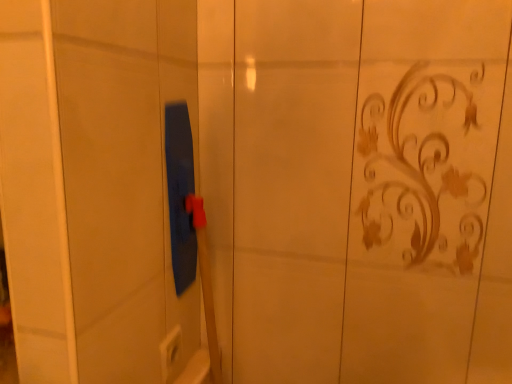
The width and height of the screenshot is (512, 384). Describe the element at coordinates (170, 353) in the screenshot. I see `white plastic electric outlet at lower center` at that location.

The image size is (512, 384). In order to click on white plastic electric outlet at lower center in this screenshot , I will do `click(170, 353)`.

The width and height of the screenshot is (512, 384). Find the location of `blue rubber squeegee at center`. blue rubber squeegee at center is located at coordinates (123, 178).

The image size is (512, 384). What do you see at coordinates (123, 178) in the screenshot? I see `blue rubber squeegee at center` at bounding box center [123, 178].

You are a GUI agent. You are given a task and a screenshot of the screen. Output one action in this format:
    pyautogui.click(x=<x>, y=<y>)
    Task: Click on the white plastic electric outlet at lower center
    
    Given the screenshot: What is the action you would take?
    pyautogui.click(x=170, y=353)

Is white plastic electric outlet at lower center to the left of blue rubber squeegee at center from the viewer's perspective?

No, white plastic electric outlet at lower center is not to the left of blue rubber squeegee at center.

Considering the relative positions of white plastic electric outlet at lower center and blue rubber squeegee at center in the image provided, is white plastic electric outlet at lower center in front of blue rubber squeegee at center?

No, it is behind blue rubber squeegee at center.

Which point is more forward, (174, 365) or (90, 187)?

The point (90, 187) is more forward.

From the image's perspective, would you say white plastic electric outlet at lower center is shown under blue rubber squeegee at center?

Yes.

From a real-world perspective, does white plastic electric outlet at lower center stand above blue rubber squeegee at center?

No, from a real-world perspective, white plastic electric outlet at lower center is not above blue rubber squeegee at center.

Does white plastic electric outlet at lower center have a lesser width compared to blue rubber squeegee at center?

Indeed, white plastic electric outlet at lower center has a lesser width compared to blue rubber squeegee at center.

Between white plastic electric outlet at lower center and blue rubber squeegee at center, which one has less height?

With less height is white plastic electric outlet at lower center.

Can you confirm if white plastic electric outlet at lower center is smaller than blue rubber squeegee at center?

Yes, white plastic electric outlet at lower center is smaller than blue rubber squeegee at center.

Is blue rubber squeegee at center inside white plastic electric outlet at lower center?

No, blue rubber squeegee at center is not surrounded by white plastic electric outlet at lower center.

Is white plastic electric outlet at lower center next to blue rubber squeegee at center and touching it?

They are not placed beside each other.

Is white plastic electric outlet at lower center aimed at blue rubber squeegee at center?

Yes, white plastic electric outlet at lower center is aimed at blue rubber squeegee at center.

How many degrees apart are the facing directions of white plastic electric outlet at lower center and blue rubber squeegee at center?

The angle between the facing direction of white plastic electric outlet at lower center and the facing direction of blue rubber squeegee at center is 90 degrees.

Locate an element on the screen. This screenshot has height=384, width=512. screen door above the white plastic electric outlet at lower center (from a real-world perspective) is located at coordinates (123, 178).

Considering the positions of objects blue rubber squeegee at center and white plastic electric outlet at lower center in the image provided, who is more to the left, blue rubber squeegee at center or white plastic electric outlet at lower center?

blue rubber squeegee at center is more to the left.

Does blue rubber squeegee at center come behind white plastic electric outlet at lower center?

No, the depth of blue rubber squeegee at center is less than that of white plastic electric outlet at lower center.

Does point (72, 294) come in front of point (165, 341)?

Yes, point (72, 294) is in front of point (165, 341).

From the image's perspective, does blue rubber squeegee at center appear lower than white plastic electric outlet at lower center?

Actually, blue rubber squeegee at center appears above white plastic electric outlet at lower center in the image.

From a real-world perspective, does blue rubber squeegee at center stand above white plastic electric outlet at lower center?

Yes.

Can you confirm if blue rubber squeegee at center is wider than white plastic electric outlet at lower center?

Yes, blue rubber squeegee at center is wider than white plastic electric outlet at lower center.

Which of these two, blue rubber squeegee at center or white plastic electric outlet at lower center, stands taller?

Standing taller between the two is blue rubber squeegee at center.

Based on the photo, in terms of size, does blue rubber squeegee at center appear bigger or smaller than white plastic electric outlet at lower center?

In the image, blue rubber squeegee at center appears to be larger than white plastic electric outlet at lower center.

Is white plastic electric outlet at lower center surrounded by blue rubber squeegee at center?

Yes, white plastic electric outlet at lower center can be found within blue rubber squeegee at center.

Would you consider blue rubber squeegee at center to be distant from white plastic electric outlet at lower center?

No, blue rubber squeegee at center is not far away from white plastic electric outlet at lower center.

Is blue rubber squeegee at center oriented away from white plastic electric outlet at lower center?

Absolutely, blue rubber squeegee at center is directed away from white plastic electric outlet at lower center.

In the scene shown: What's the angular difference between blue rubber squeegee at center and white plastic electric outlet at lower center's facing directions?

They differ by 90 degrees in their facing directions.

Measure the distance from blue rubber squeegee at center to white plastic electric outlet at lower center.

They are 12.73 inches apart.

Where is `screen door on the left side of white plastic electric outlet at lower center`? The height and width of the screenshot is (384, 512). screen door on the left side of white plastic electric outlet at lower center is located at coordinates (123, 178).

Identify the location of screen door that appears on the left of white plastic electric outlet at lower center. This screenshot has width=512, height=384. (123, 178).

Where is `electric outlet that is on the right side of blue rubber squeegee at center`? electric outlet that is on the right side of blue rubber squeegee at center is located at coordinates (170, 353).